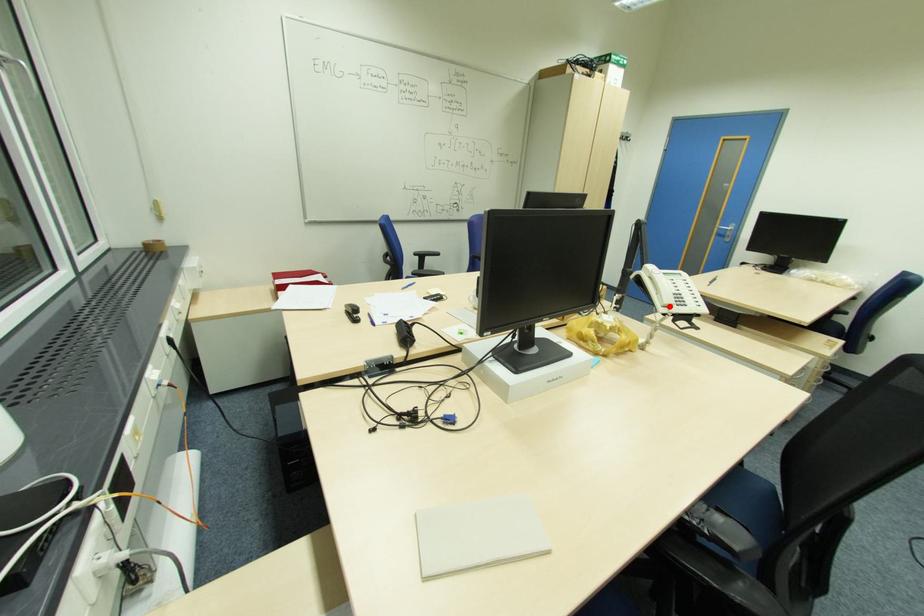
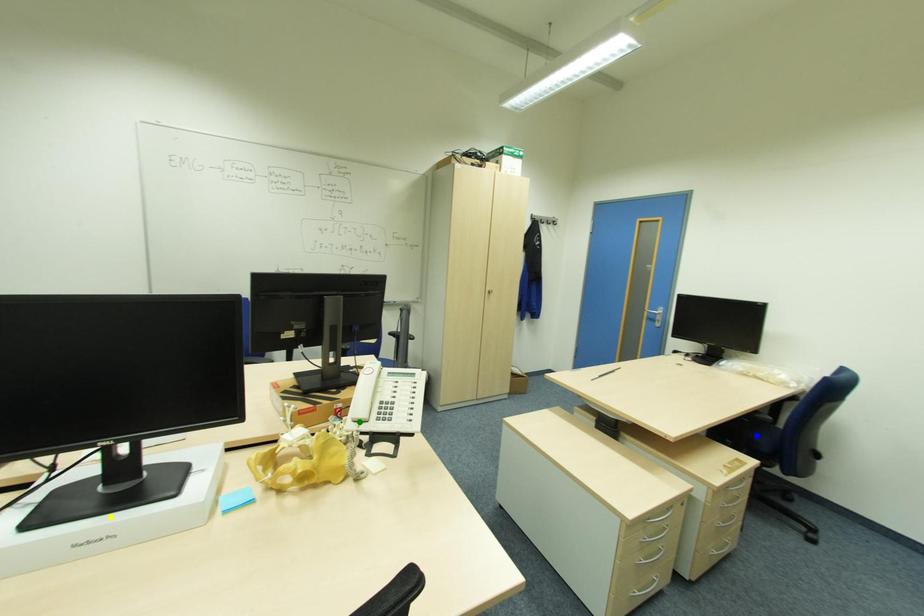
Question: I am providing you with two images of the same scene from different viewpoints. A red point is marked on the first image. You are given multiple points on the second image. Can you choose the point in image 2 that corresponds to the point in image 1?

Choices:
 (A) blue point
 (B) green point
 (C) yellow point

Answer: (B)